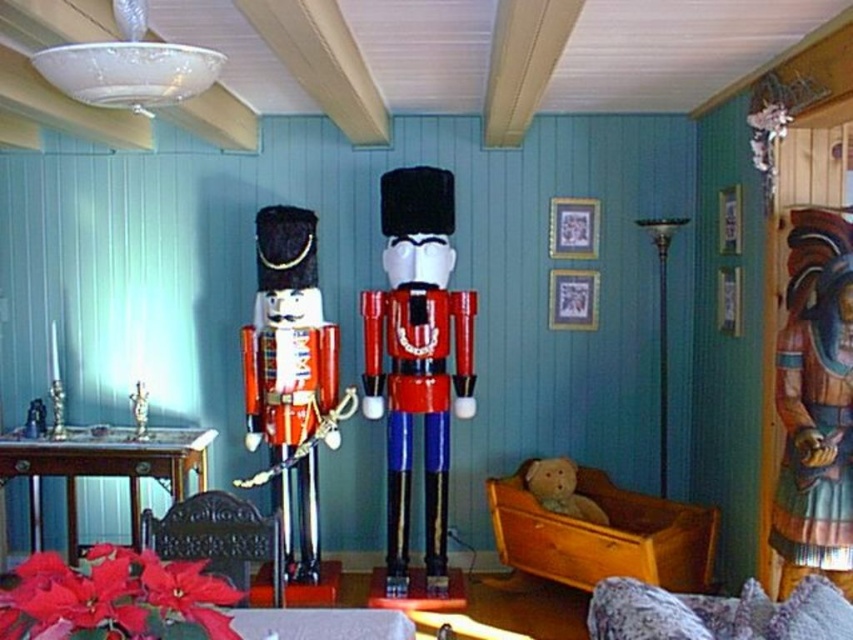
Who is higher up, wooden polished table at lower left or metallic silver figurine at center?

metallic silver figurine at center

Can you confirm if wooden polished table at lower left is bigger than metallic silver figurine at center?

Correct, wooden polished table at lower left is larger in size than metallic silver figurine at center.

Does point (125, 467) lie in front of point (142, 390)?

Yes, point (125, 467) is in front of point (142, 390).

You are a GUI agent. You are given a task and a screenshot of the screen. Output one action in this format:
    pyautogui.click(x=<x>, y=<y>)
    Task: Click on the wooden polished table at lower left
    The height and width of the screenshot is (640, 853).
    Given the screenshot: What is the action you would take?
    pyautogui.click(x=109, y=465)

Which is behind, point (804, 458) or point (136, 435)?

The point (136, 435) is more distant.

Can you confirm if wooden carved figure at right is bigger than metallic silver figurine at center?

Yes, wooden carved figure at right is bigger than metallic silver figurine at center.

At what (x,y) coordinates should I click in order to perform the action: click on wooden carved figure at right. Please return your answer as a coordinate pair (x, y). This screenshot has height=640, width=853. Looking at the image, I should click on (815, 404).

Who is more forward, (540,541) or (44,420)?

Point (540,541)

Is wooden toy chest at center closer to the viewer compared to metallic silver candlestick at left?

That is True.

Is point (643, 508) more distant than point (35, 436)?

Yes, it is behind point (35, 436).

Image resolution: width=853 pixels, height=640 pixels. Find the location of `wooden toy chest at center`. wooden toy chest at center is located at coordinates (599, 536).